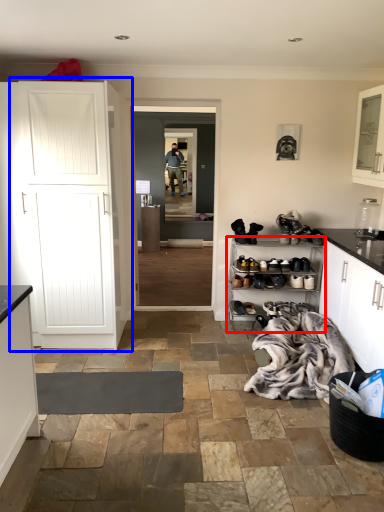
Question: Which object appears farthest to the camera in this image, shelf (highlighted by a red box) or cupboard (highlighted by a blue box)?

Choices:
 (A) shelf
 (B) cupboard

Answer: (A)